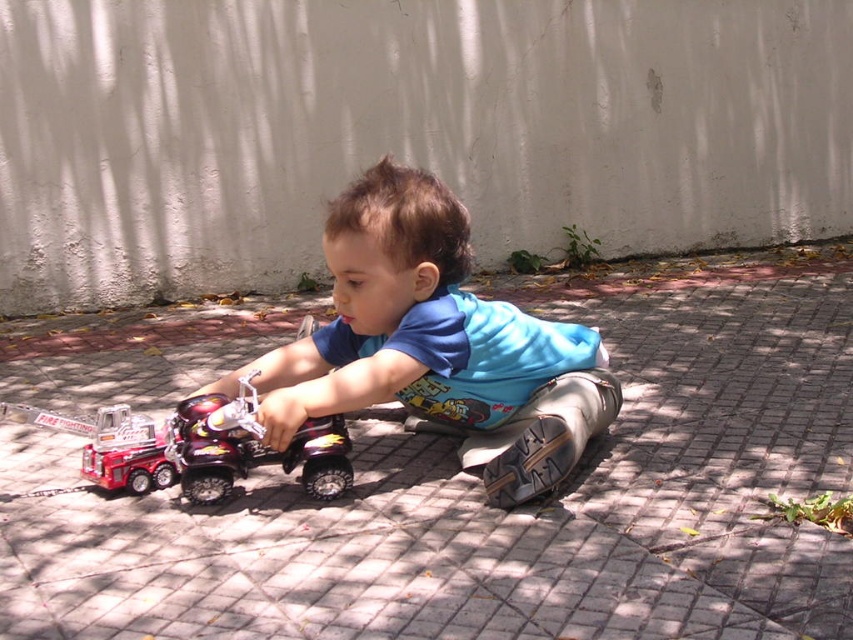
Is brick pavement at center shorter than blue cotton shirt at center?

Indeed, brick pavement at center has a lesser height compared to blue cotton shirt at center.

Between point (12, 493) and point (503, 333), which one is positioned behind?

Positioned behind is point (503, 333).

Is point (41, 499) positioned before point (485, 381)?

Yes, point (41, 499) is closer to viewer.

Image resolution: width=853 pixels, height=640 pixels. Find the location of `brick pavement at center`. brick pavement at center is located at coordinates (500, 509).

In the scene shown: Does brick pavement at center have a smaller size compared to metallic red fire truck at lower left?

Incorrect, brick pavement at center is not smaller in size than metallic red fire truck at lower left.

Between point (50, 396) and point (99, 476), which one is positioned in front?

Positioned in front is point (99, 476).

At what (x,y) coordinates should I click in order to perform the action: click on brick pavement at center. Please return your answer as a coordinate pair (x, y). The height and width of the screenshot is (640, 853). Looking at the image, I should click on (500, 509).

Is blue cotton shirt at center closer to the viewer compared to metallic red fire truck at lower left?

That is True.

Who is lower down, blue cotton shirt at center or metallic red fire truck at lower left?

metallic red fire truck at lower left is lower down.

This screenshot has height=640, width=853. Find the location of `blue cotton shirt at center`. blue cotton shirt at center is located at coordinates (434, 344).